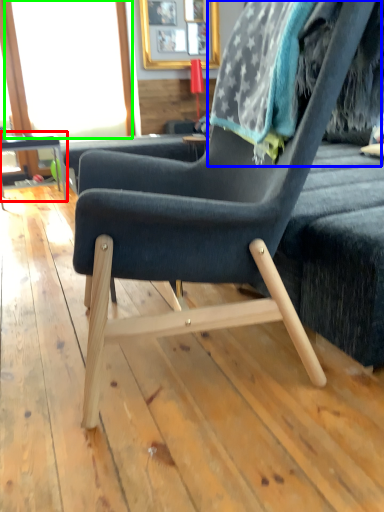
Question: Which object is the farthest from table (highlighted by a red box)? Choose among these: bean bag chair (highlighted by a blue box) or window screen (highlighted by a green box).

Choices:
 (A) bean bag chair
 (B) window screen

Answer: (A)